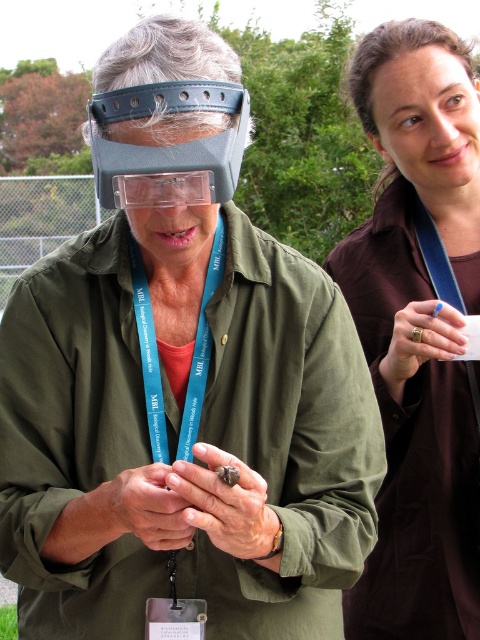
Question: Which of the following is the farthest from the observer?

Choices:
 (A) (158, 438)
 (B) (121, 148)

Answer: (A)

Question: Based on their relative distances, which object is nearer to the brown matte shirt at upper right?

Choices:
 (A) teal fabric lanyard at center
 (B) matte plastic goggles at center

Answer: (A)

Question: Can you confirm if matte plastic goggles at center is bigger than teal fabric lanyard at center?

Choices:
 (A) yes
 (B) no

Answer: (A)

Question: Does matte plastic goggles at center appear under teal fabric lanyard at center?

Choices:
 (A) yes
 (B) no

Answer: (B)

Question: Which of the following is the closest to the observer?

Choices:
 (A) teal fabric lanyard at center
 (B) brown matte shirt at upper right
 (C) matte plastic goggles at center

Answer: (C)

Question: Does brown matte shirt at upper right appear over matte plastic goggles at center?

Choices:
 (A) yes
 (B) no

Answer: (B)